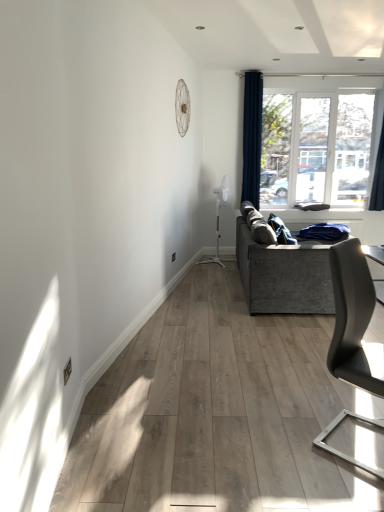
Question: Considering the relative positions of dark blue fabric curtain at upper right, which is counted as the 2th curtain, starting from the left, and textured gray couch at right in the image provided, is dark blue fabric curtain at upper right, which is counted as the 2th curtain, starting from the left, to the right of textured gray couch at right from the viewer's perspective?

Choices:
 (A) no
 (B) yes

Answer: (B)

Question: Considering the relative sizes of dark blue fabric curtain at upper right, placed as the first curtain when sorted from right to left, and textured gray couch at right in the image provided, is dark blue fabric curtain at upper right, placed as the first curtain when sorted from right to left, thinner than textured gray couch at right?

Choices:
 (A) yes
 (B) no

Answer: (A)

Question: From the image's perspective, does dark blue fabric curtain at upper right, placed as the first curtain when sorted from right to left, appear higher than textured gray couch at right?

Choices:
 (A) yes
 (B) no

Answer: (A)

Question: Is dark blue fabric curtain at upper right, placed as the first curtain when sorted from right to left, beside textured gray couch at right?

Choices:
 (A) no
 (B) yes

Answer: (A)

Question: Can textured gray couch at right be found inside dark blue fabric curtain at upper right, placed as the first curtain when sorted from right to left?

Choices:
 (A) no
 (B) yes

Answer: (A)

Question: From a real-world perspective, is transparent glass window at upper right positioned above or below dark blue fabric curtain at upper right, arranged as the first curtain when viewed from the left?

Choices:
 (A) below
 (B) above

Answer: (A)

Question: Looking at their shapes, would you say transparent glass window at upper right is wider or thinner than dark blue fabric curtain at upper right, which ranks as the second curtain in right-to-left order?

Choices:
 (A) thin
 (B) wide

Answer: (A)

Question: From the image's perspective, is transparent glass window at upper right above or below dark blue fabric curtain at upper right, which ranks as the second curtain in right-to-left order?

Choices:
 (A) above
 (B) below

Answer: (B)

Question: Is transparent glass window at upper right spatially inside dark blue fabric curtain at upper right, arranged as the first curtain when viewed from the left, or outside of it?

Choices:
 (A) inside
 (B) outside

Answer: (B)

Question: Is textured gray couch at right bigger or smaller than dark blue fabric curtain at upper right, which ranks as the second curtain in right-to-left order?

Choices:
 (A) big
 (B) small

Answer: (A)

Question: Considering the positions of textured gray couch at right and dark blue fabric curtain at upper right, which ranks as the second curtain in right-to-left order, in the image, is textured gray couch at right taller or shorter than dark blue fabric curtain at upper right, which ranks as the second curtain in right-to-left order,?

Choices:
 (A) tall
 (B) short

Answer: (B)

Question: In terms of width, does textured gray couch at right look wider or thinner when compared to dark blue fabric curtain at upper right, arranged as the first curtain when viewed from the left?

Choices:
 (A) wide
 (B) thin

Answer: (A)

Question: Would you say textured gray couch at right is inside or outside dark blue fabric curtain at upper right, arranged as the first curtain when viewed from the left?

Choices:
 (A) outside
 (B) inside

Answer: (A)

Question: Does point (375, 184) appear closer or farther from the camera than point (364, 137)?

Choices:
 (A) closer
 (B) farther

Answer: (B)

Question: From the image's perspective, is dark blue fabric curtain at upper right, which is counted as the 2th curtain, starting from the left, above or below transparent glass window at upper right?

Choices:
 (A) above
 (B) below

Answer: (B)